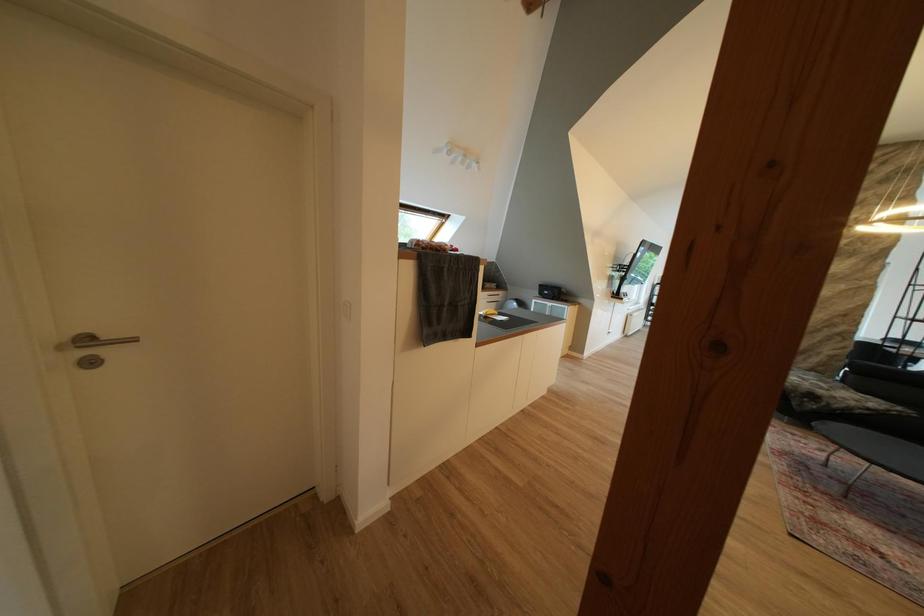
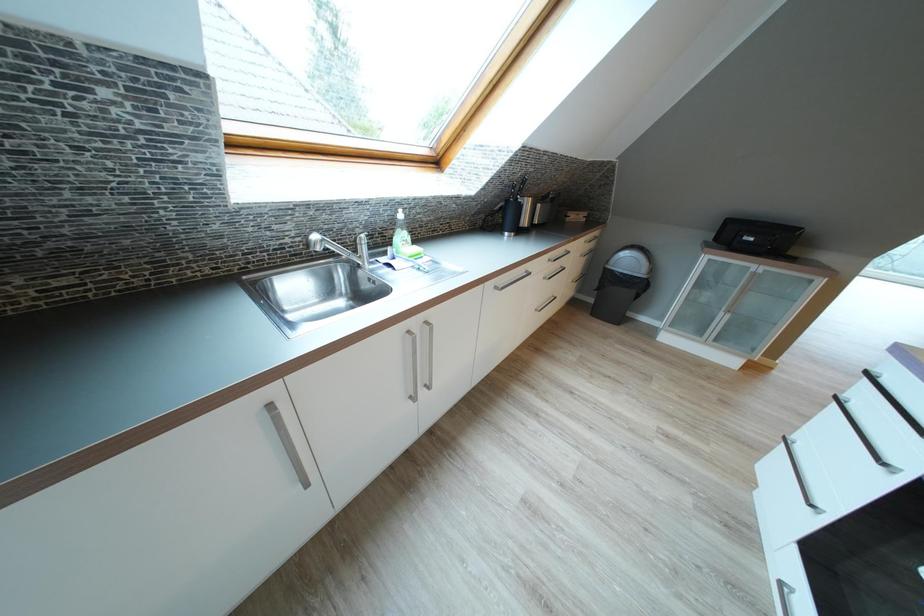
Question: What movement of the cameraman would produce the second image?

Choices:
 (A) Left
 (B) Right
 (C) Forward
 (D) Backward

Answer: (C)